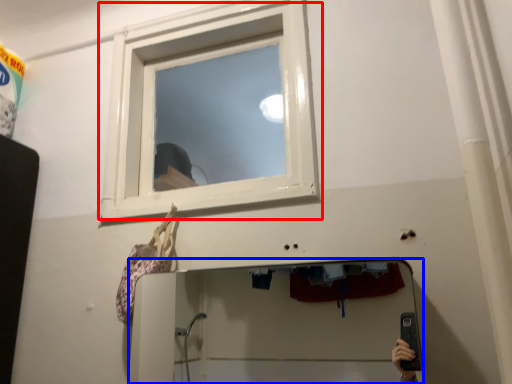
Question: Among these objects, which one is nearest to the camera, window (highlighted by a red box) or mirror (highlighted by a blue box)?

Choices:
 (A) window
 (B) mirror

Answer: (B)